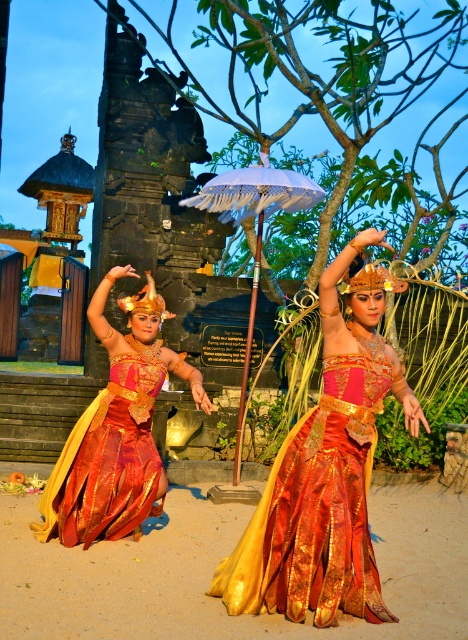
Is shiny gold dress at center above white fringed umbrella at center?

Incorrect, shiny gold dress at center is not positioned above white fringed umbrella at center.

Does shiny gold dress at center have a greater width compared to white fringed umbrella at center?

In fact, shiny gold dress at center might be narrower than white fringed umbrella at center.

Who is more forward, (162,355) or (241,449)?

Point (162,355)

The image size is (468, 640). In order to click on shiny gold dress at center in this screenshot , I will do `click(117, 429)`.

Measure the distance between shiny silk skirt at center and camera.

4.88 meters

Who is lower down, shiny silk skirt at center or shiny gold dress at center?

shiny silk skirt at center is lower down.

Find the location of `shiny silk skirt at center`. shiny silk skirt at center is located at coordinates (316, 508).

Can you confirm if shiny silk skirt at center is positioned to the right of white fringed umbrella at center?

Yes, shiny silk skirt at center is to the right of white fringed umbrella at center.

Which is in front, point (321, 502) or point (255, 257)?

Point (321, 502) is in front.

Between point (356, 387) and point (265, 163), which one is positioned in front?

Point (356, 387) is in front.

At what (x,y) coordinates should I click in order to perform the action: click on shiny silk skirt at center. Please return your answer as a coordinate pair (x, y). Looking at the image, I should click on (316, 508).